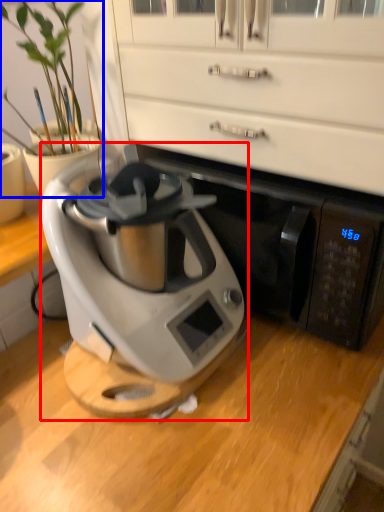
Question: Which object appears closest to the camera in this image, home appliance (highlighted by a red box) or houseplant (highlighted by a blue box)?

Choices:
 (A) home appliance
 (B) houseplant

Answer: (A)